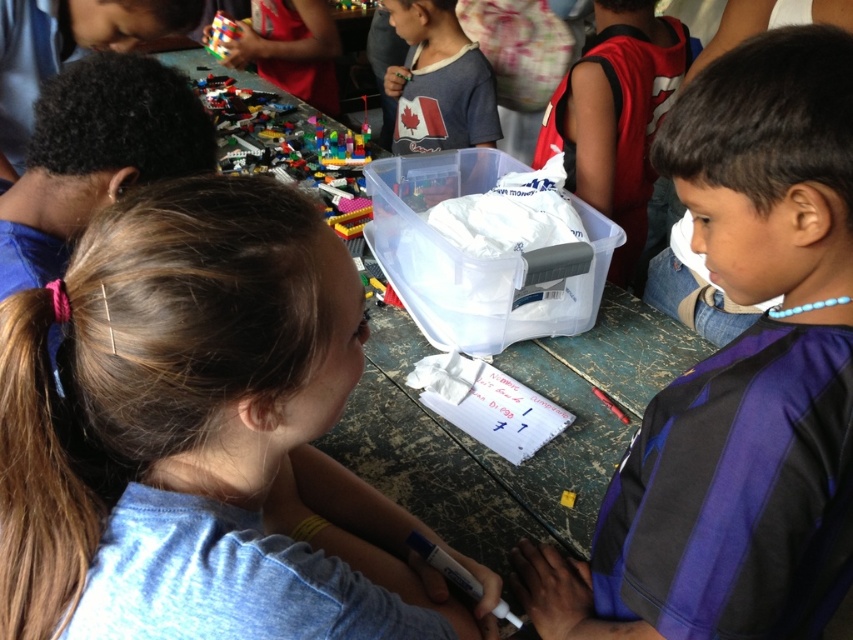
You are a photographer taking a picture of the scene. The matte white shirt at center and the white paper at center are both in the frame. Which object will appear closer to the camera?

The matte white shirt at center will appear closer to the camera because it is in front of the white paper at center according to the description.